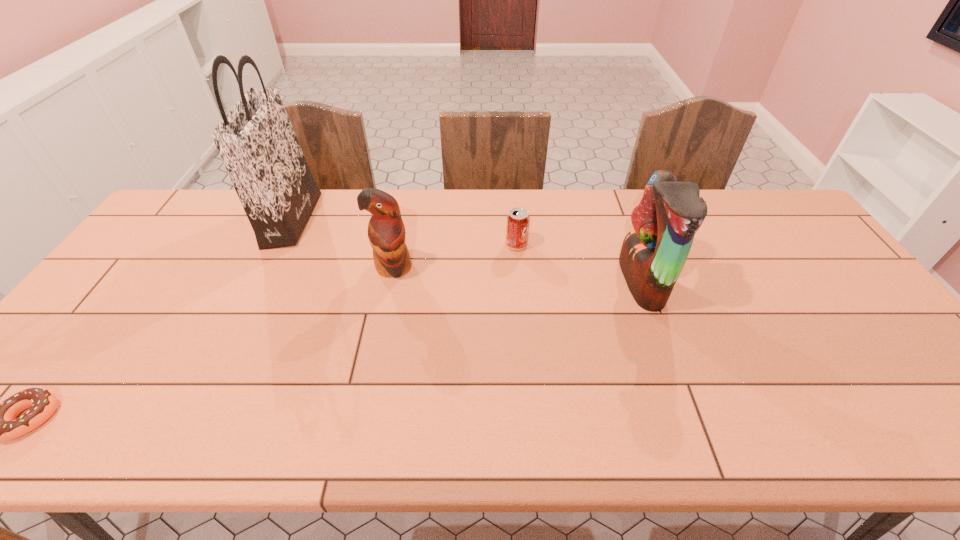
Identify the location of shopping bag. (256, 141).

Where is `the tallest object`? the tallest object is located at coordinates (256, 141).

Find the location of a particular element. The width and height of the screenshot is (960, 540). the right parrot is located at coordinates (653, 254).

Identify the location of the third object from left to right. (386, 232).

Identify the location of the shorter parrot. (386, 232).

Locate an element on the screen. the second object from right to left is located at coordinates (517, 228).

You are a GUI agent. You are given a task and a screenshot of the screen. Output one action in this format:
    pyautogui.click(x=<x>, y=<y>)
    Task: Click on the soda can
    Image resolution: width=960 pixels, height=540 pixels.
    Given the screenshot: What is the action you would take?
    pyautogui.click(x=517, y=228)

This screenshot has width=960, height=540. Find the location of `free space located 0.110m on the front of the shopping bag with the design`. free space located 0.110m on the front of the shopping bag with the design is located at coordinates (344, 220).

Locate an element on the screen. vacant space located 0.210m at the face of the right parrot is located at coordinates (548, 282).

Find the location of a particular element. Image resolution: width=960 pixels, height=540 pixels. vacant region located 0.260m at the face of the right parrot is located at coordinates (531, 282).